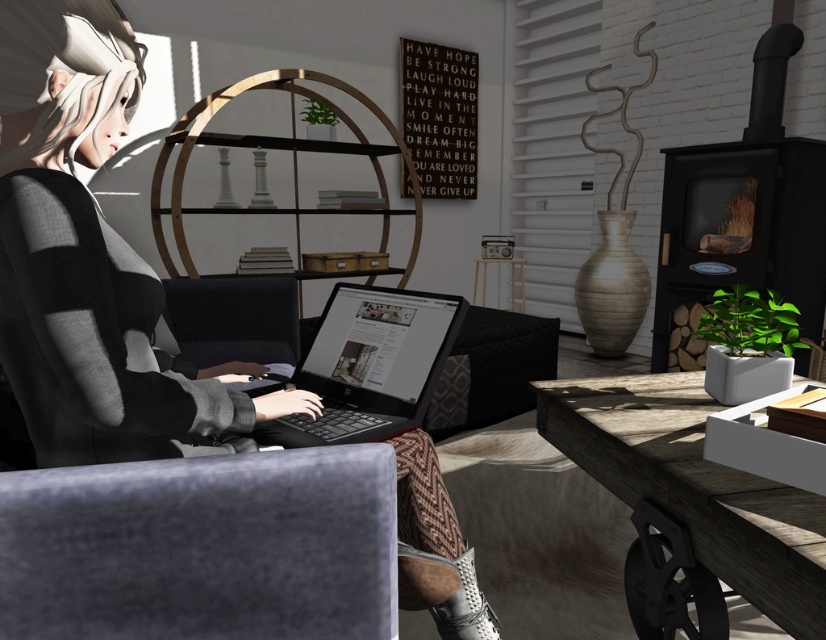
From the picture: You are a person sitting on the dark gray armchair and want to place your matte black laptop at center onto the wooden table at lower right. Can you move it directly to the table without moving your chair?

The matte black laptop at center is to the left of the wooden table at lower right, so you can reach it by extending your arm or moving slightly to the right without needing to move your chair.

You are standing in the living room and want to place a 4 feet long decorative rod horizontally on the table to the right of the black plastic laptop at center. Can you fit it without it overhanging the edge?

The distance of black plastic laptop at center from camera is 3.85 feet. Since the decorative rod is 4 feet long, it would overhang the edge of the table unless the table is longer than 4 feet. However, the table dimensions are not provided, so we cannot confirm if it will fit.

You are standing in the living room and want to place a small plant between the two points, point [171,364] and point [696,422]. Which point should the plant be closer to so it stays behind the wooden table?

The plant should be closer to point [171,364] because it is behind point [696,422], so placing it near that point would keep it behind the wooden table.